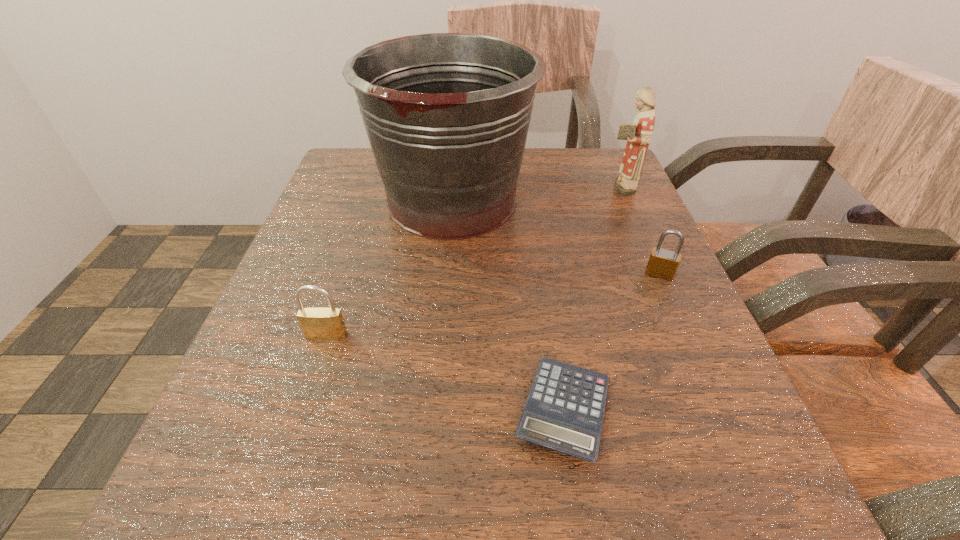
The image size is (960, 540). I want to click on free spot located on the front-facing side of the fourth shortest object, so click(534, 187).

Identify the location of free space located 0.050m on the front-facing side of the fourth shortest object. This screenshot has width=960, height=540. (580, 187).

Identify the location of blank space located on the front-facing side of the left padlock. This screenshot has height=540, width=960. (305, 401).

At what (x,y) coordinates should I click in order to perform the action: click on blank area located 0.230m on the front of the farther padlock. Please return your answer as a coordinate pair (x, y). Looking at the image, I should click on (717, 406).

Locate an element on the screen. The height and width of the screenshot is (540, 960). vacant space positioned 0.150m on the right of the shortest object is located at coordinates (733, 409).

Where is `bucket that is at the far edge`? The width and height of the screenshot is (960, 540). bucket that is at the far edge is located at coordinates (447, 115).

At what (x,y) coordinates should I click in order to perform the action: click on figurine at the far edge. Please return your answer as a coordinate pair (x, y). Looking at the image, I should click on (639, 134).

You are a GUI agent. You are given a task and a screenshot of the screen. Output one action in this format:
    pyautogui.click(x=<x>, y=<y>)
    Task: Click on the object that is at the near edge
    This screenshot has height=540, width=960.
    Given the screenshot: What is the action you would take?
    pyautogui.click(x=564, y=411)

At what (x,y) coordinates should I click in order to perform the action: click on bucket that is positioned at the left edge. Please return your answer as a coordinate pair (x, y). This screenshot has width=960, height=540. Looking at the image, I should click on (447, 115).

At what (x,y) coordinates should I click in order to perform the action: click on padlock located in the left edge section of the desktop. Please return your answer as a coordinate pair (x, y). This screenshot has width=960, height=540. Looking at the image, I should click on (317, 323).